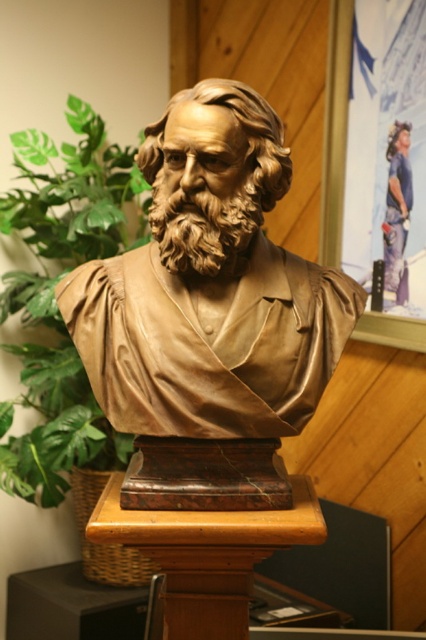
Question: Does bronze statue at center have a greater width compared to green leafy plant at center?

Choices:
 (A) no
 (B) yes

Answer: (B)

Question: Can you confirm if bronze statue at center is bigger than green leafy plant at center?

Choices:
 (A) yes
 (B) no

Answer: (B)

Question: Which object appears farthest from the camera in this image?

Choices:
 (A) green leafy plant at center
 (B) bronze statue at center

Answer: (A)

Question: Which point appears closest to the camera in this image?

Choices:
 (A) (290, 429)
 (B) (134, 173)

Answer: (A)

Question: Is bronze statue at center to the left of green leafy plant at center from the viewer's perspective?

Choices:
 (A) no
 (B) yes

Answer: (A)